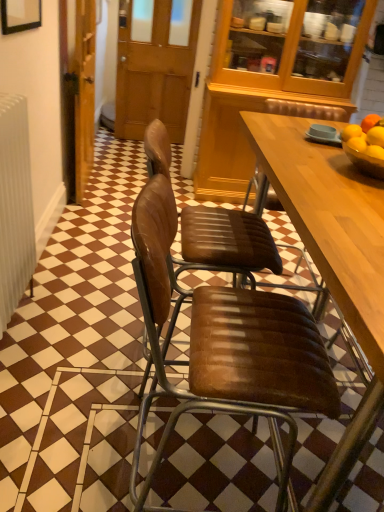
Question: Is yellow matte/orange matte/orange bowl at right at the left side of brown wooden door at center?

Choices:
 (A) yes
 (B) no

Answer: (B)

Question: Considering the relative sizes of yellow matte/orange matte/orange bowl at right and brown wooden door at center in the image provided, is yellow matte/orange matte/orange bowl at right bigger than brown wooden door at center?

Choices:
 (A) no
 (B) yes

Answer: (A)

Question: Considering the relative sizes of yellow matte/orange matte/orange bowl at right and brown wooden door at center in the image provided, is yellow matte/orange matte/orange bowl at right taller than brown wooden door at center?

Choices:
 (A) yes
 (B) no

Answer: (B)

Question: Is yellow matte/orange matte/orange bowl at right turned away from brown wooden door at center?

Choices:
 (A) yes
 (B) no

Answer: (B)

Question: Is yellow matte/orange matte/orange bowl at right far from brown wooden door at center?

Choices:
 (A) yes
 (B) no

Answer: (A)

Question: Considering the positions of point (87, 136) and point (162, 58), is point (87, 136) closer or farther from the camera than point (162, 58)?

Choices:
 (A) farther
 (B) closer

Answer: (B)

Question: Is wooden door at left inside or outside of brown wooden door at center?

Choices:
 (A) inside
 (B) outside

Answer: (B)

Question: Based on their sizes in the image, would you say wooden door at left is bigger or smaller than brown wooden door at center?

Choices:
 (A) small
 (B) big

Answer: (B)

Question: From a real-world perspective, is wooden door at left positioned above or below brown wooden door at center?

Choices:
 (A) above
 (B) below

Answer: (B)

Question: Is brown leather chair at center, arranged as the 2th chair when ordered from the bottom, spatially inside brown wooden door at center, or outside of it?

Choices:
 (A) outside
 (B) inside

Answer: (A)

Question: Is brown leather chair at center, arranged as the 2th chair when ordered from the bottom, wider or thinner than brown wooden door at center?

Choices:
 (A) wide
 (B) thin

Answer: (A)

Question: Based on their sizes in the image, would you say brown leather chair at center, the first chair when ordered from top to bottom, is bigger or smaller than brown wooden door at center?

Choices:
 (A) big
 (B) small

Answer: (A)

Question: Relative to brown wooden door at center, is brown leather chair at center, the first chair when ordered from top to bottom, in front or behind?

Choices:
 (A) front
 (B) behind

Answer: (A)

Question: Considering the positions of brown leather chair at center, the first chair when ordered from top to bottom, and wooden door at left in the image, is brown leather chair at center, the first chair when ordered from top to bottom, bigger or smaller than wooden door at left?

Choices:
 (A) small
 (B) big

Answer: (A)

Question: Based on their positions, is brown leather chair at center, arranged as the 2th chair when ordered from the bottom, located to the left or right of wooden door at left?

Choices:
 (A) left
 (B) right

Answer: (B)